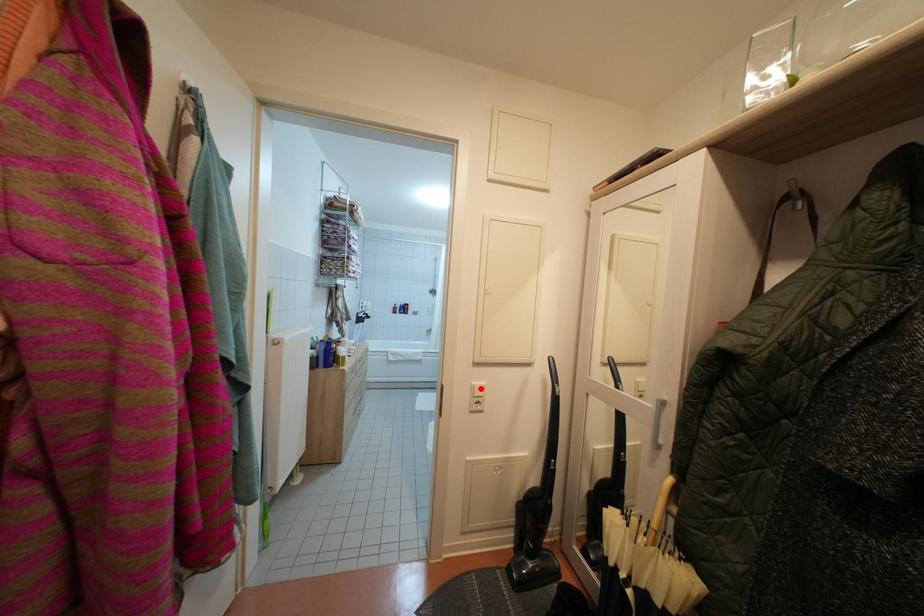
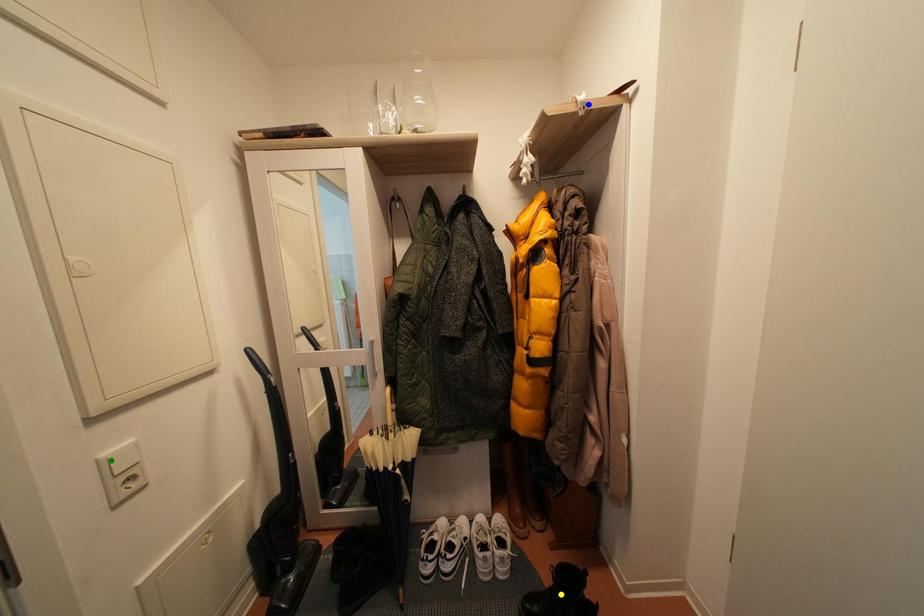
Question: I am providing you with two images of the same scene from different viewpoints. A red point is marked on the first image. You are given multiple points on the second image. Can you choose the point in image 2 that corresponds to the point in image 1?

Choices:
 (A) blue point
 (B) green point
 (C) yellow point

Answer: (B)